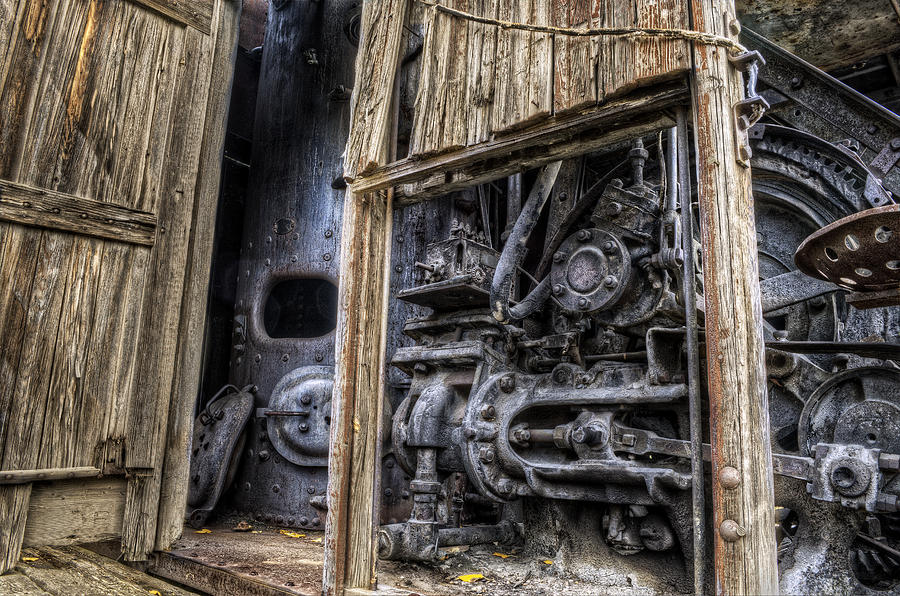
At what (x,y) coordinates should I click in order to perform the action: click on wooden boards above opening. Please return your answer as a coordinate pair (x, y). This screenshot has height=596, width=900. Looking at the image, I should click on (516, 70), (460, 80), (572, 69), (642, 55).